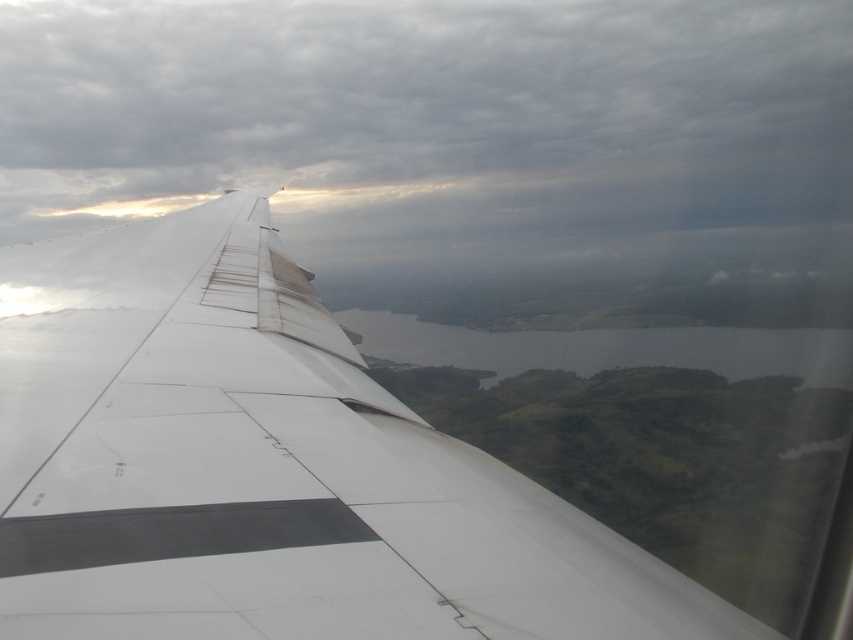
You are a passenger sitting by the window in an aircraft. You notice the cloudy gray sky at upper center and the white matte wing at upper left. Which object is closer to you based on their positions?

The cloudy gray sky at upper center is closer to you because the white matte wing at upper left is behind it.

In the scene shown: You are a pilot checking the weather conditions. You notice the cloudy gray sky at upper center and the white matte wing at upper left. Which object appears wider from your current view?

The cloudy gray sky at upper center might be wider than white matte wing at upper left according to the description.